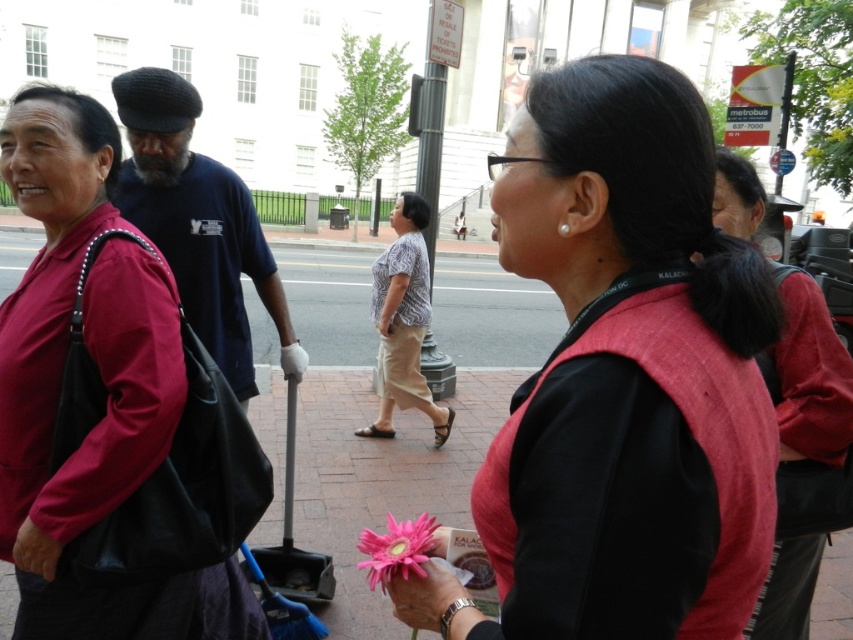
Image resolution: width=853 pixels, height=640 pixels. What do you see at coordinates (622, 380) in the screenshot?
I see `pink fabric flower at center` at bounding box center [622, 380].

From the picture: Which of these two, pink fabric flower at center or pink matte flower at lower center, stands taller?

pink fabric flower at center is taller.

At what (x,y) coordinates should I click in order to perform the action: click on pink fabric flower at center. Please return your answer as a coordinate pair (x, y). This screenshot has width=853, height=640. Looking at the image, I should click on (622, 380).

Find the location of `pink fabric flower at center`. pink fabric flower at center is located at coordinates (622, 380).

Which of these two, matte black bag at left or pink matte flower at lower center, stands shorter?

pink matte flower at lower center

Measure the distance between matte black bag at left and pink matte flower at lower center.

matte black bag at left is 83.41 centimeters away from pink matte flower at lower center.

You are a GUI agent. You are given a task and a screenshot of the screen. Output one action in this format:
    pyautogui.click(x=<x>, y=<y>)
    Task: Click on the matte black bag at left
    
    Given the screenshot: What is the action you would take?
    pyautogui.click(x=103, y=384)

What do you see at coordinates (622, 380) in the screenshot? Image resolution: width=853 pixels, height=640 pixels. I see `pink fabric flower at center` at bounding box center [622, 380].

Is point (608, 477) positioned before point (3, 330)?

Yes.

What do you see at coordinates (622, 380) in the screenshot? Image resolution: width=853 pixels, height=640 pixels. I see `pink fabric flower at center` at bounding box center [622, 380].

Where is `pink fabric flower at center`? Image resolution: width=853 pixels, height=640 pixels. pink fabric flower at center is located at coordinates (622, 380).